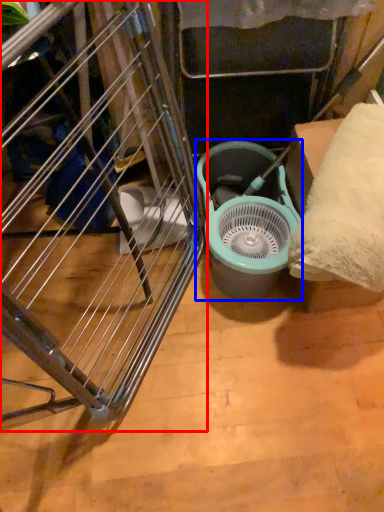
Question: Among these objects, which one is farthest to the camera, furniture (highlighted by a red box) or mechanical fan (highlighted by a blue box)?

Choices:
 (A) furniture
 (B) mechanical fan

Answer: (B)